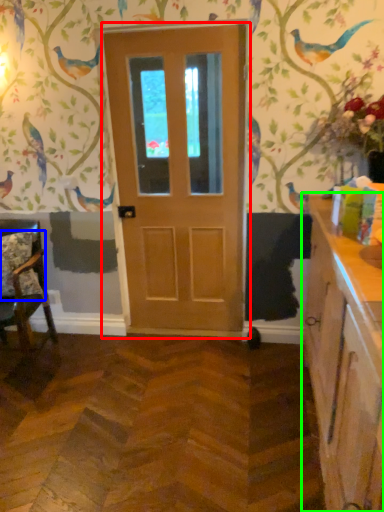
Question: Based on their relative distances, which object is farther from door (highlighted by a red box)? Choose from pillow (highlighted by a blue box) and cabinetry (highlighted by a green box).

Choices:
 (A) pillow
 (B) cabinetry

Answer: (B)